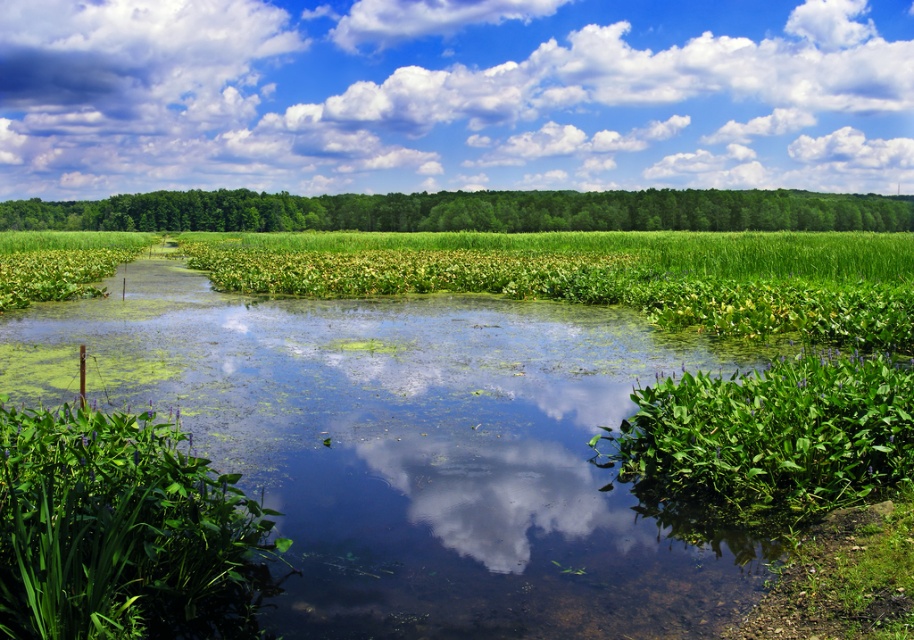
From the picture: You are standing at the origin point in the image and want to reach the point at the back. Which point should you choose between point [147,124] and point [125,209]?

You should choose point [147,124] because it is behind point [125,209] according to the description.

You are standing in the serene landscape described. You notice a point marked at coordinates (453, 96). What object is this point located on?

The point at coordinates (453, 96) is located on the white fluffy cloud at upper center.

You are a photographer trying to capture the white fluffy cloud at upper center and the green leafy plants at center in a single frame. Which object should you adjust your camera to focus on first if you want to include both in your shot?

You should focus on the green leafy plants at center first because the white fluffy cloud at upper center is positioned on the right side of them, meaning the cloud is farther away from the camera. By focusing on the closer object, you can ensure both are in the frame.